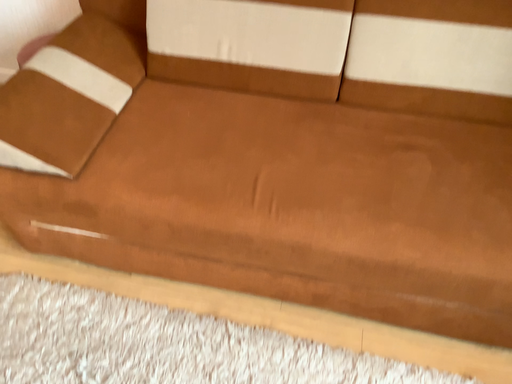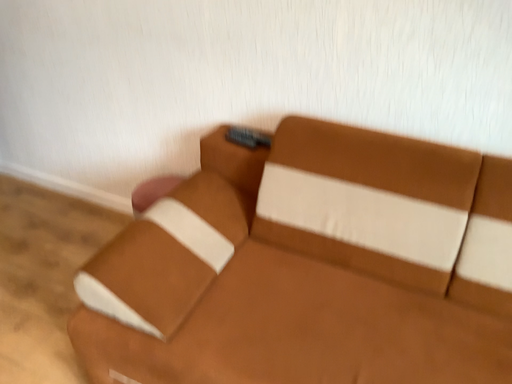
Question: How did the camera likely rotate when shooting the video?

Choices:
 (A) rotated right
 (B) rotated left

Answer: (B)